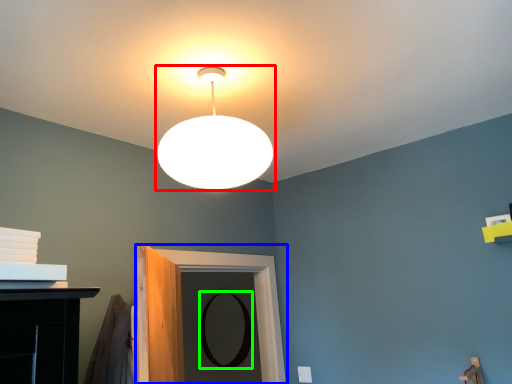
Question: Which object is the closest to the lamp (highlighted by a red box)? Choose among these: door (highlighted by a blue box) or mirror (highlighted by a green box).

Choices:
 (A) door
 (B) mirror

Answer: (A)